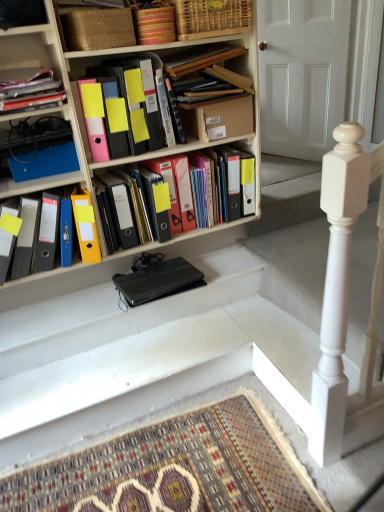
The image size is (384, 512). Find the location of `vacant space to the left of black matte laptop at center`. vacant space to the left of black matte laptop at center is located at coordinates (88, 305).